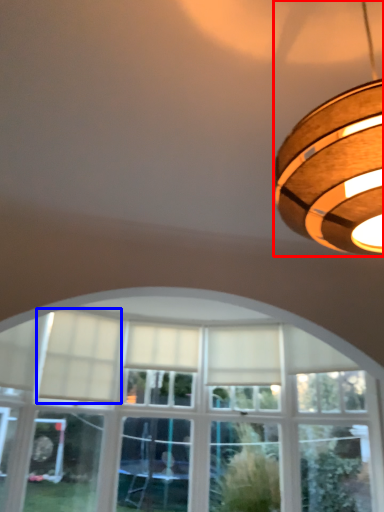
Question: Which object appears closest to the camera in this image, lamp (highlighted by a red box) or curtain (highlighted by a blue box)?

Choices:
 (A) lamp
 (B) curtain

Answer: (A)